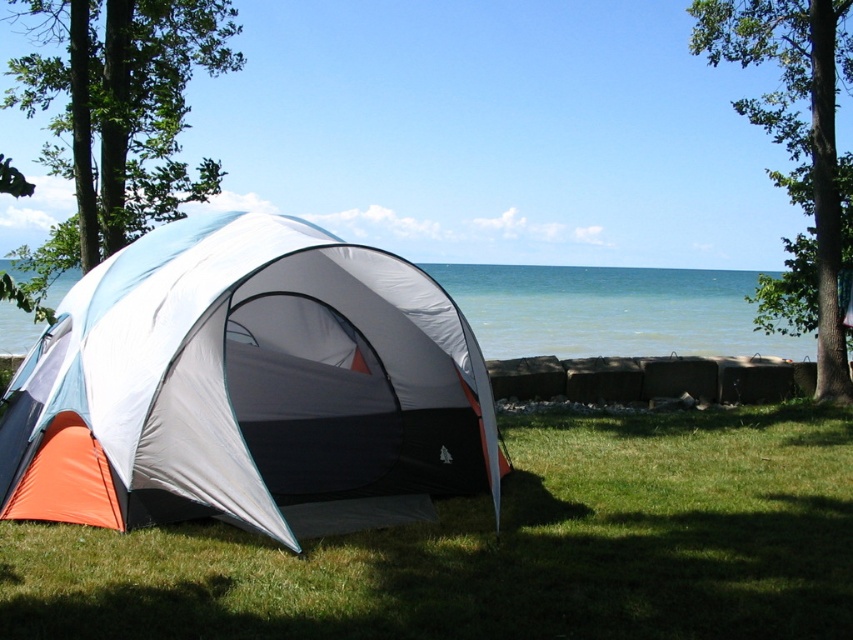
Question: Can you confirm if blue water at center is positioned to the left of green leafy tree at upper right?

Choices:
 (A) no
 (B) yes

Answer: (B)

Question: Is the position of orange fabric tent at lower left less distant than that of blue water at center?

Choices:
 (A) no
 (B) yes

Answer: (B)

Question: Based on their relative distances, which object is nearer to the blue water at center?

Choices:
 (A) green grass at lower center
 (B) green leafy tree at upper right
 (C) green leafy tree at upper left
 (D) orange fabric tent at lower left

Answer: (B)

Question: Which of the following is the closest to the observer?

Choices:
 (A) green leafy tree at upper right
 (B) green grass at lower center
 (C) blue water at center

Answer: (B)

Question: Which point is closer to the camera taking this photo?

Choices:
 (A) (824, 294)
 (B) (209, 376)
 (C) (521, 307)
 (D) (666, 522)

Answer: (B)

Question: In this image, where is green grass at lower center located relative to blue water at center?

Choices:
 (A) below
 (B) above

Answer: (A)